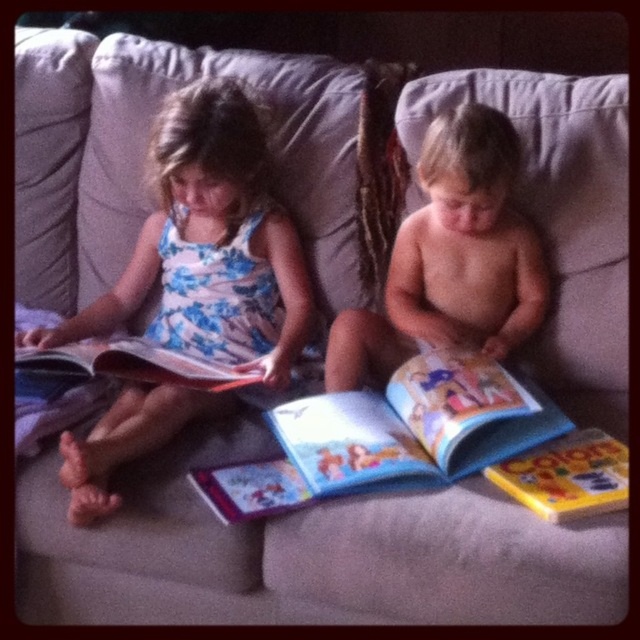
You are a photographer standing in front of the two children. You want to take a photo of the floral dress at left and the hardcover book at center. Which object should you focus on first to ensure both are in sharp focus?

You should focus on the floral dress at left first because it is closer to you than the hardcover book at center, so starting with the closer object will help both be in focus.

You are a photographer trying to capture a closeup of the floral dress at left and the hardcover book at center. Since you want both items to be in focus, you need to adjust your camera settings so that the depth of field can cover both objects. Given their sizes, which object requires you to focus closer to it to ensure sharpness?

The floral dress at left is thinner than the hardcover book at center, so focusing closer to the floral dress at left would ensure both are in focus.

You are a photographer trying to capture a closeup of the floral dress at left without the hardcover book at left blocking the view. Can you adjust your position to achieve this?

The floral dress at left is in front of the hardcover book at left, so you can position yourself directly facing the floral dress at left to avoid the book obstructing the view.